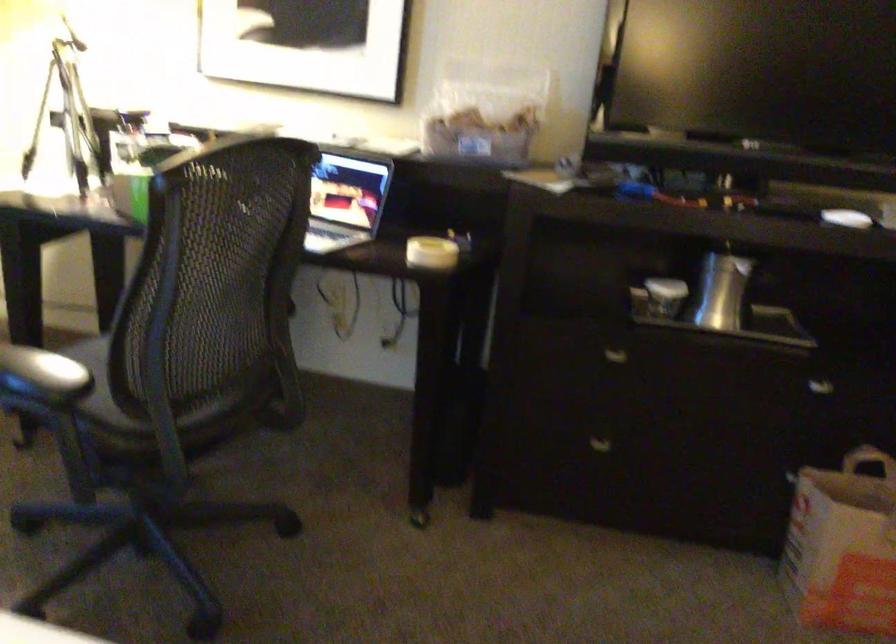
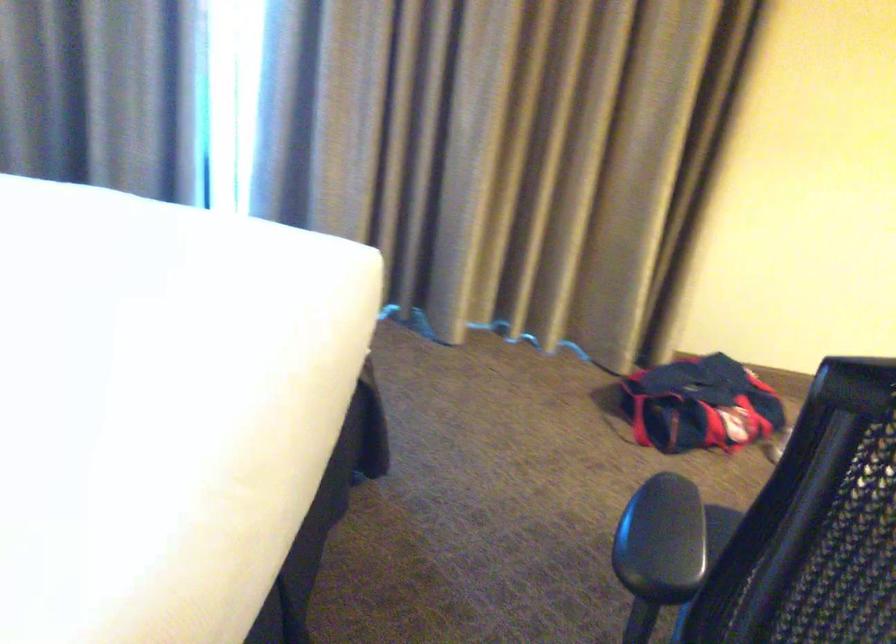
The first image is from the beginning of the video and the second image is from the end. How did the camera likely rotate when shooting the video?

The camera's rotation is toward left-down.